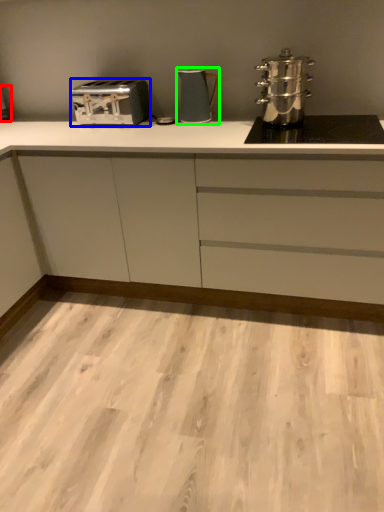
Question: Which object is positioned farthest from appliance (highlighted by a red box)? Select from toaster (highlighted by a blue box) and kitchen appliance (highlighted by a green box).

Choices:
 (A) toaster
 (B) kitchen appliance

Answer: (B)